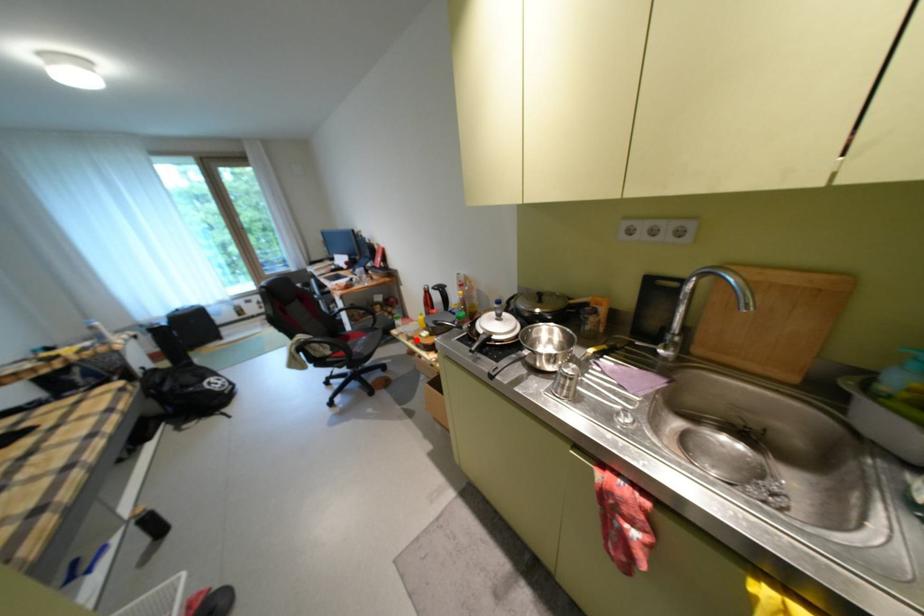
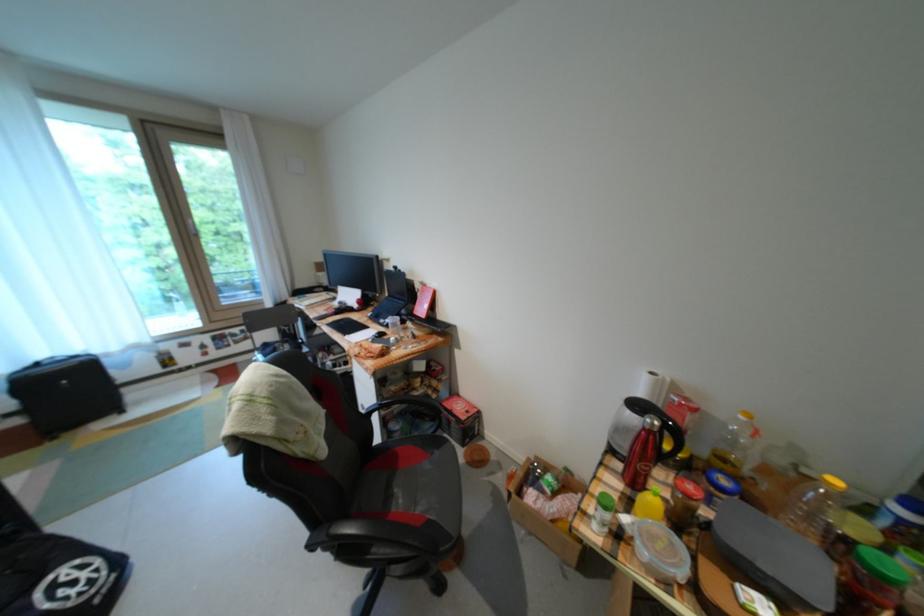
Question: I am providing you with two images of the same scene from different viewpoints. In image1, a red point is highlighted. Considering the same 3D point in image2, which of the following is correct?

Choices:
 (A) It is closer
 (B) It is farther

Answer: (A)